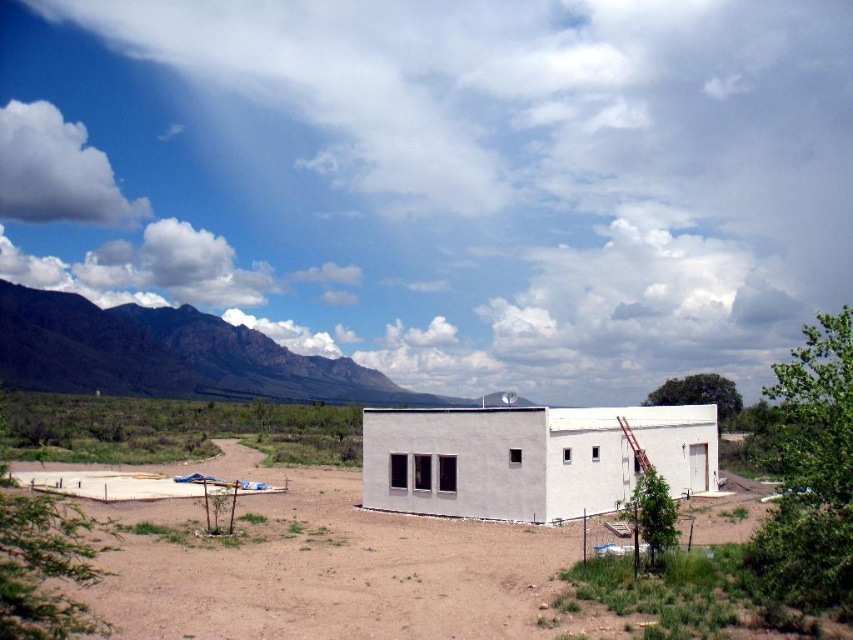
Which is behind, point (357, 540) or point (490, 442)?

Point (490, 442)

Is dirt at center thinner than white smooth building at center?

Incorrect, dirt at center's width is not less than white smooth building at center's.

What do you see at coordinates (340, 570) in the screenshot? This screenshot has height=640, width=853. I see `dirt at center` at bounding box center [340, 570].

Identify the location of dirt at center. (340, 570).

Which of these two, dirt at center or gray rocky mountain at left, stands shorter?

dirt at center is shorter.

Between point (425, 636) and point (45, 316), which one is positioned behind?

Positioned behind is point (45, 316).

Where is `dirt at center`? Image resolution: width=853 pixels, height=640 pixels. dirt at center is located at coordinates (340, 570).

What do you see at coordinates (529, 458) in the screenshot? This screenshot has width=853, height=640. I see `white smooth building at center` at bounding box center [529, 458].

Is point (381, 500) closer to viewer compared to point (36, 301)?

Yes, it is.

You are a GUI agent. You are given a task and a screenshot of the screen. Output one action in this format:
    pyautogui.click(x=<x>, y=<y>)
    Task: Click on the white smooth building at center
    The height and width of the screenshot is (640, 853).
    Given the screenshot: What is the action you would take?
    pyautogui.click(x=529, y=458)